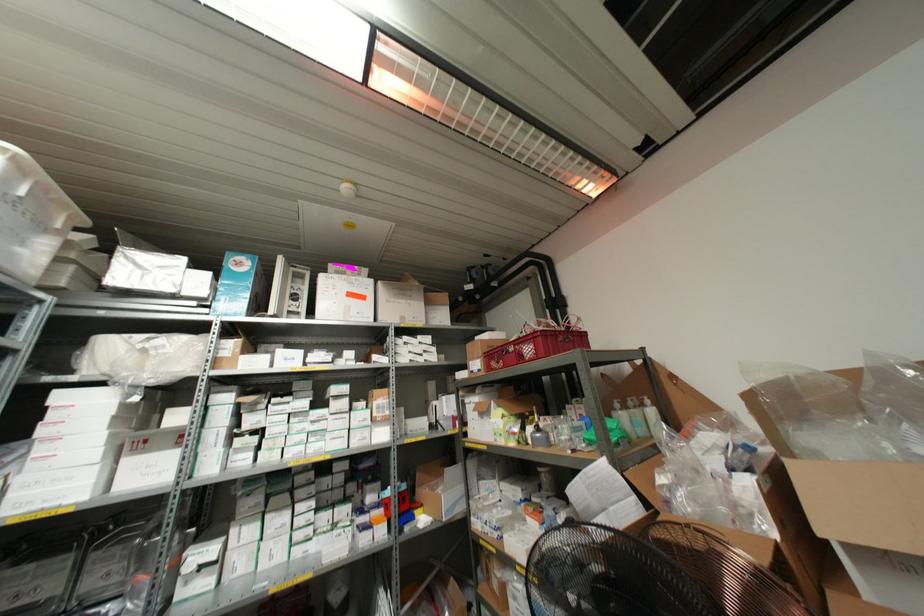
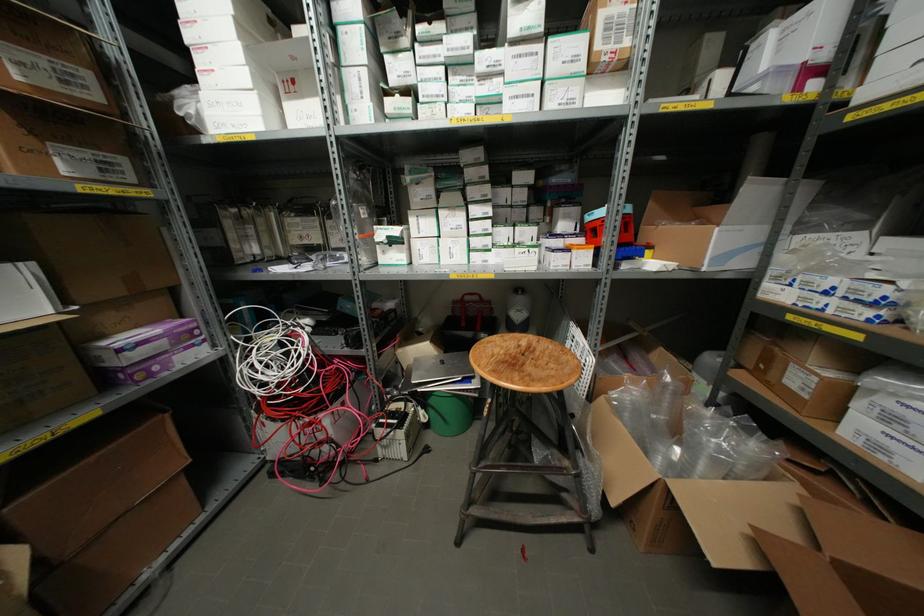
Where in the second image is the point corresponding to [42,431] from the first image?

(188, 36)